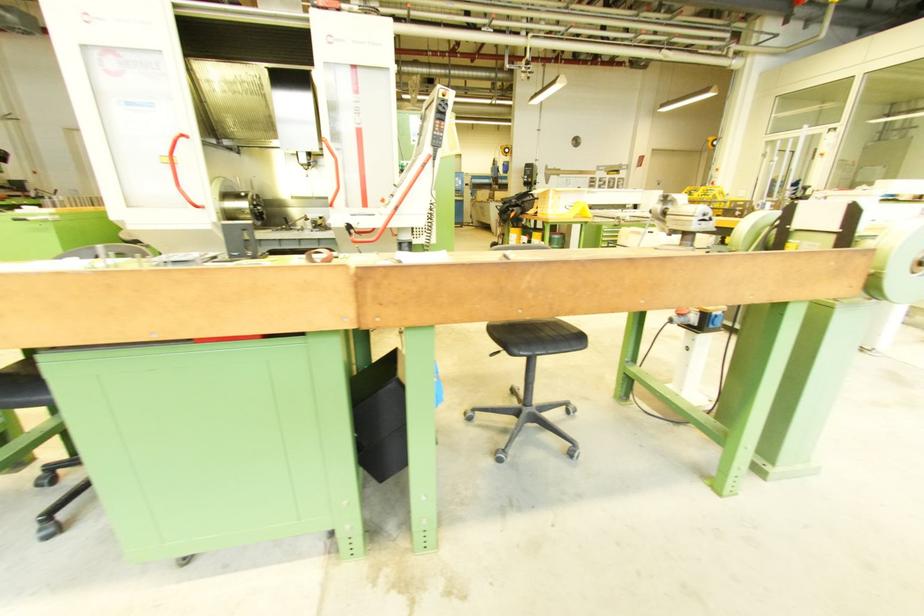
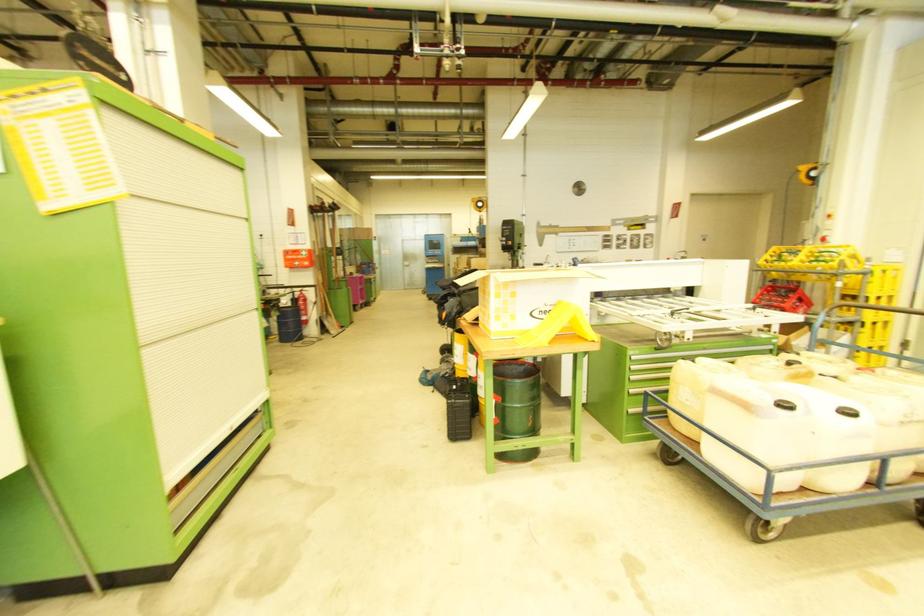
The point at (605, 229) is marked in the first image. Where is the corresponding point in the second image?

(631, 355)